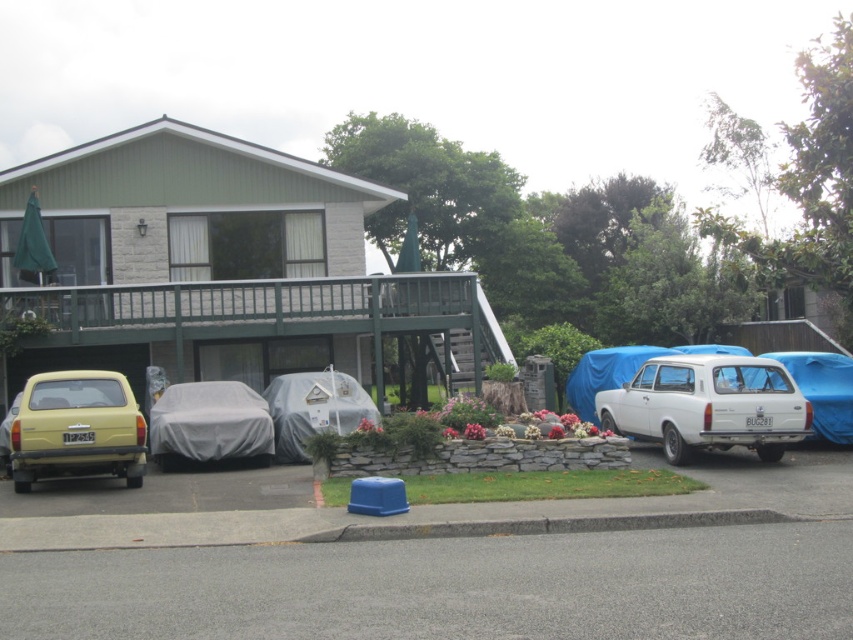
Question: Can you confirm if white matte station wagon at right is positioned above matte yellow car at left?

Choices:
 (A) yes
 (B) no

Answer: (B)

Question: Does white matte station wagon at right appear on the right side of matte yellow car at left?

Choices:
 (A) no
 (B) yes

Answer: (B)

Question: Is the position of white matte station wagon at right less distant than that of matte yellow car at left?

Choices:
 (A) yes
 (B) no

Answer: (B)

Question: Which object is farther from the camera taking this photo?

Choices:
 (A) white matte station wagon at right
 (B) matte yellow car at left

Answer: (A)

Question: Which point is farther to the camera?

Choices:
 (A) (693, 380)
 (B) (45, 426)

Answer: (A)

Question: Which of the following is the closest to the observer?

Choices:
 (A) white matte station wagon at right
 (B) matte yellow car at left

Answer: (B)